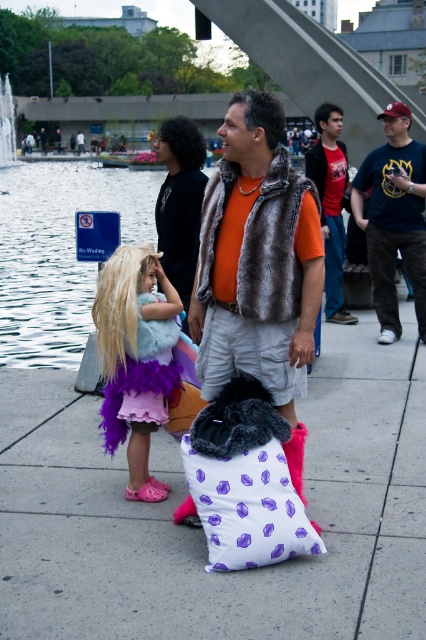
Is point (339, 253) less distant than point (0, 160)?

Yes, it is in front of point (0, 160).

Between point (337, 147) and point (2, 129), which one is positioned behind?

The point (2, 129) is behind.

Image resolution: width=426 pixels, height=640 pixels. Identify the location of red t-shirt at center. (331, 204).

At what (x,y) coordinates should I click in order to perform the action: click on red t-shirt at center. Please return your answer as a coordinate pair (x, y). Looking at the image, I should click on click(x=331, y=204).

Does white dotted pillow at lower center have a greater width compared to dark brown fur vest at center?

Indeed, white dotted pillow at lower center has a greater width compared to dark brown fur vest at center.

Which is in front, point (199, 449) or point (175, 275)?

Point (199, 449) is in front.

Is point (241, 531) in front of point (193, 166)?

Yes, it is in front of point (193, 166).

Where is `white dotted pillow at lower center`? This screenshot has height=640, width=426. white dotted pillow at lower center is located at coordinates (245, 497).

Consider the image. Is orange fur vest at center thinner than dark blue t-shirt at center?

Indeed, orange fur vest at center has a lesser width compared to dark blue t-shirt at center.

Is the position of orange fur vest at center more distant than that of dark blue t-shirt at center?

That is False.

What do you see at coordinates (256, 257) in the screenshot?
I see `orange fur vest at center` at bounding box center [256, 257].

Find the location of a particular element. orange fur vest at center is located at coordinates (256, 257).